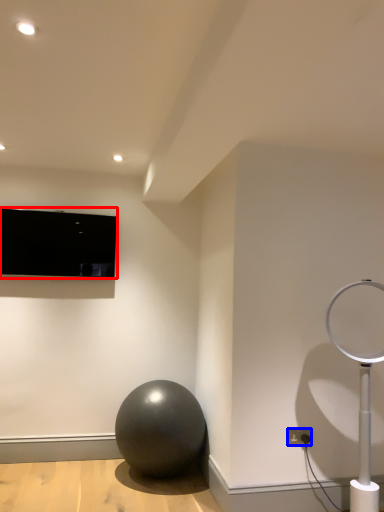
Question: Which object appears closest to the camera in this image, television (highlighted by a red box) or electric outlet (highlighted by a blue box)?

Choices:
 (A) television
 (B) electric outlet

Answer: (B)